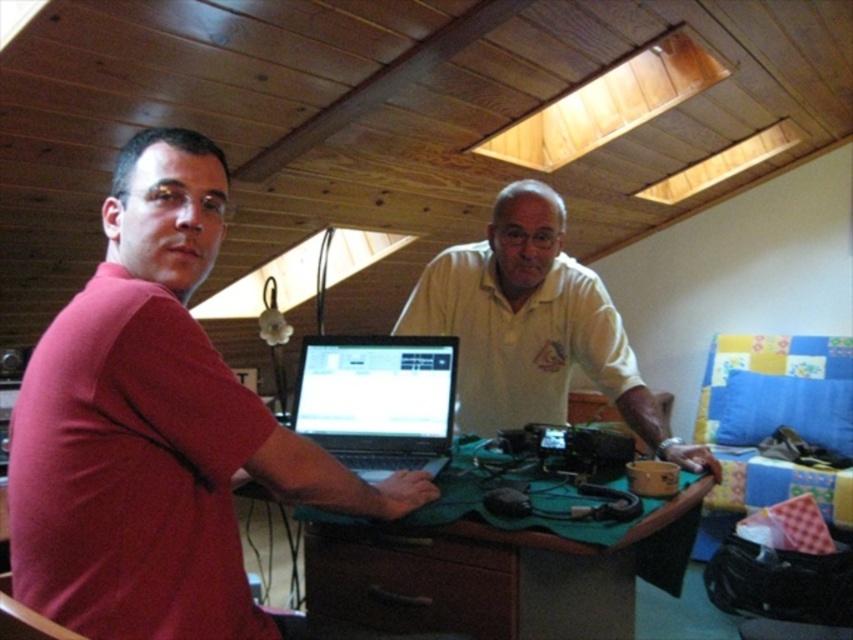
Where is `white matte shirt at center`? The width and height of the screenshot is (853, 640). white matte shirt at center is located at coordinates (532, 326).

Does white matte shirt at center have a smaller size compared to matte black laptop at center?

No, white matte shirt at center is not smaller than matte black laptop at center.

Find the location of a particular element. white matte shirt at center is located at coordinates (532, 326).

Where is `white matte shirt at center`? The image size is (853, 640). white matte shirt at center is located at coordinates click(x=532, y=326).

Which is above, matte red shirt at center or green felt at center?

Positioned higher is matte red shirt at center.

Between point (199, 193) and point (444, 632), which one is positioned behind?

The point (444, 632) is behind.

Identify the location of matte red shirt at center. The height and width of the screenshot is (640, 853). [155, 428].

Which is more to the right, green felt at center or white matte shirt at center?

white matte shirt at center is more to the right.

Does green felt at center have a lesser width compared to white matte shirt at center?

Incorrect, green felt at center's width is not less than white matte shirt at center's.

Does point (672, 561) lie in front of point (482, 253)?

That is True.

Find the location of a particular element. Image resolution: width=853 pixels, height=640 pixels. green felt at center is located at coordinates (495, 568).